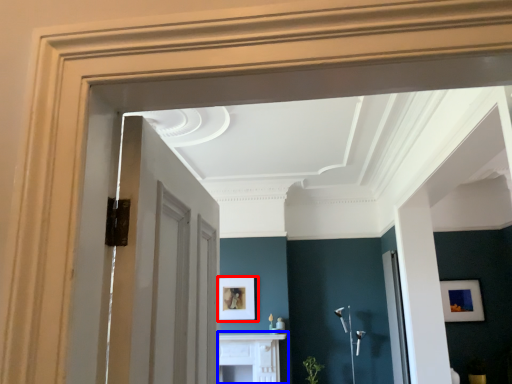
Question: Which point is further to the camera, picture frame (highlighted by a red box) or table (highlighted by a blue box)?

Choices:
 (A) picture frame
 (B) table

Answer: (A)